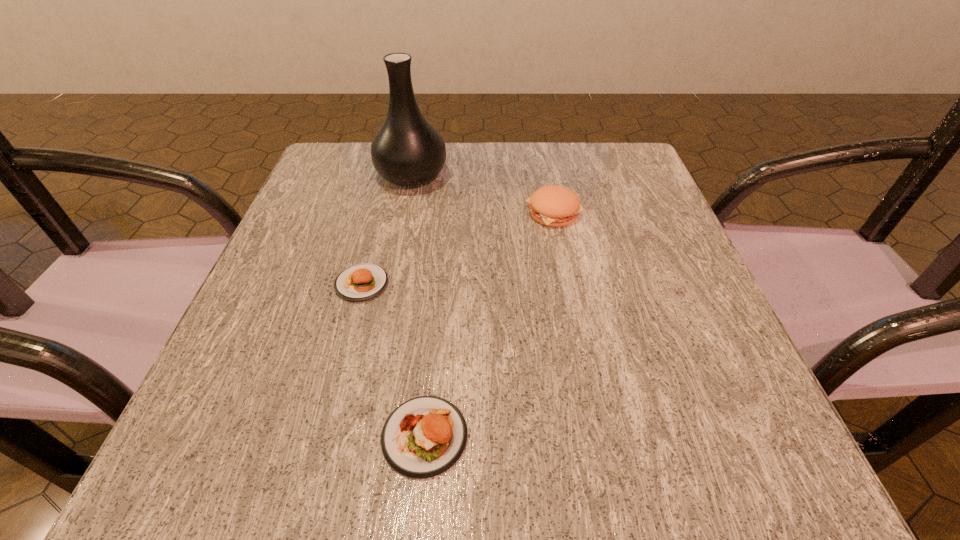
The height and width of the screenshot is (540, 960). Identify the location of free spot that satisfies the following two spatial constraints: 1. on the back side of the vase; 2. on the left side of the second nearest object. (391, 175).

Locate an element on the screen. free space in the image that satisfies the following two spatial constraints: 1. on the back side of the second tallest object; 2. on the left side of the shortest object is located at coordinates (381, 212).

I want to click on free point that satisfies the following two spatial constraints: 1. on the back side of the rightmost object; 2. on the right side of the shortest object, so click(x=381, y=212).

I want to click on blank space that satisfies the following two spatial constraints: 1. on the front side of the shortest object; 2. on the right side of the nearest food, so click(322, 436).